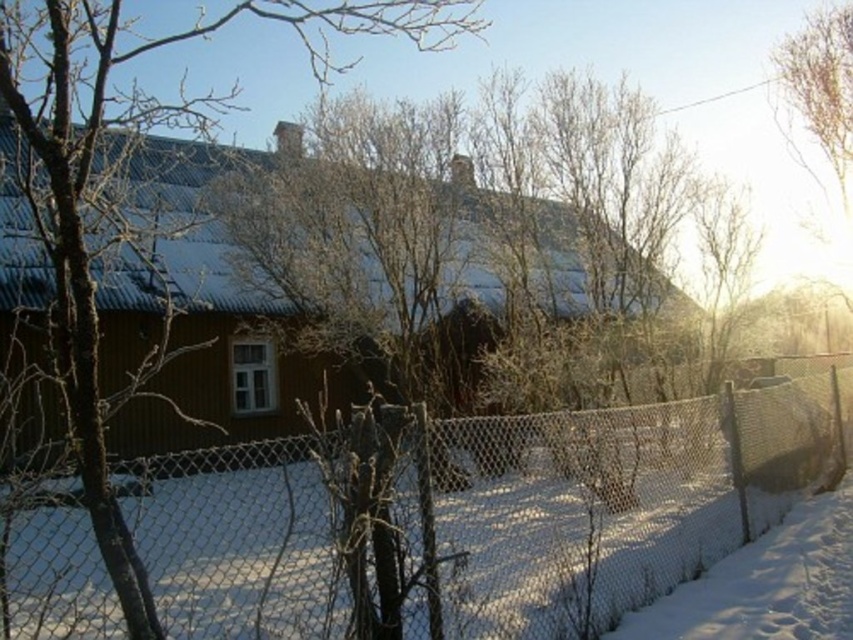
Between wire mesh fence at center and brown wood tree at center, which one appears on the left side from the viewer's perspective?

brown wood tree at center is more to the left.

Which is in front, point (294, 582) or point (68, 221)?

Positioned in front is point (68, 221).

What do you see at coordinates (624, 497) in the screenshot?
I see `wire mesh fence at center` at bounding box center [624, 497].

Identify the location of wire mesh fence at center. (624, 497).

Does brown wood tree at center have a larger size compared to white powdery snow at lower right?

Yes.

Does point (97, 497) come closer to viewer compared to point (679, 604)?

Yes, point (97, 497) is closer to viewer.

This screenshot has width=853, height=640. What are the coordinates of `brown wood tree at center` in the screenshot? It's located at (148, 125).

The height and width of the screenshot is (640, 853). What do you see at coordinates (624, 497) in the screenshot?
I see `wire mesh fence at center` at bounding box center [624, 497].

Does wire mesh fence at center lie behind white powdery snow at lower right?

No, wire mesh fence at center is closer to the viewer.

The height and width of the screenshot is (640, 853). I want to click on wire mesh fence at center, so click(624, 497).

Find the location of a particular element. This screenshot has width=853, height=640. wire mesh fence at center is located at coordinates (624, 497).